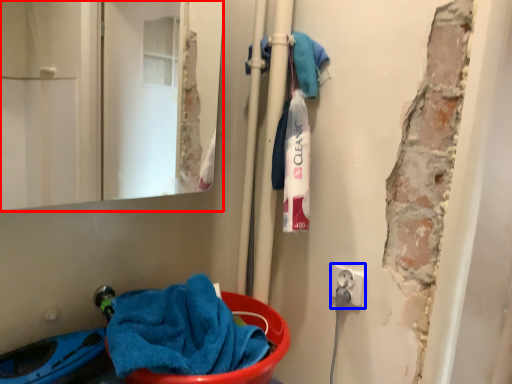
Question: Which point is further to the camera, mirror (highlighted by a red box) or electric outlet (highlighted by a blue box)?

Choices:
 (A) mirror
 (B) electric outlet

Answer: (B)